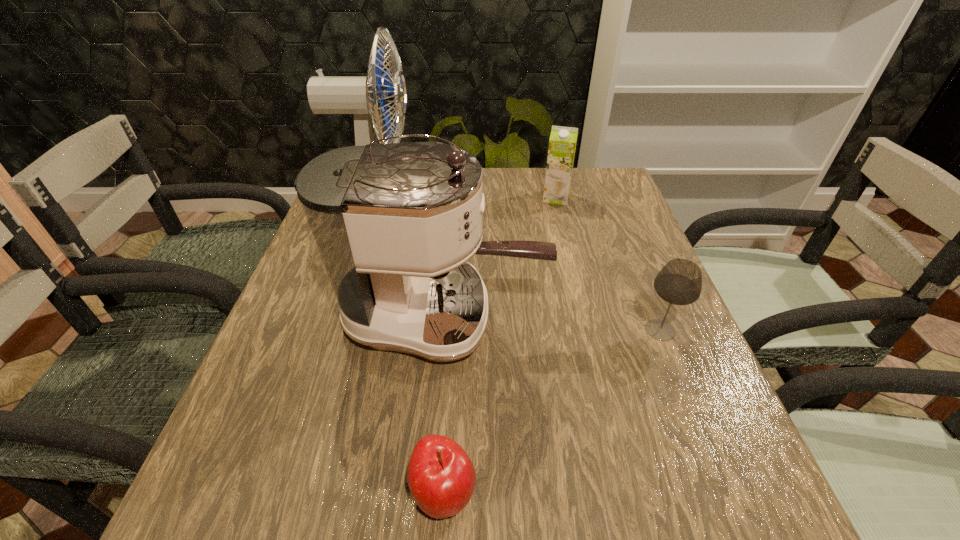
Where is `object at the far left corner`? object at the far left corner is located at coordinates [364, 96].

Locate an element on the screen. The image size is (960, 540). object located in the far right corner section of the desktop is located at coordinates (562, 144).

I want to click on vacant region at the far edge, so click(x=568, y=205).

The width and height of the screenshot is (960, 540). In the image, there is a desktop. What are the coordinates of `vacant space at the left edge` in the screenshot? It's located at [x=263, y=384].

Locate an element on the screen. This screenshot has width=960, height=540. vacant area at the right edge is located at coordinates (635, 252).

At what (x,y) coordinates should I click in order to perform the action: click on vacant space at the far right corner. Please return your answer as a coordinate pair (x, y). Looking at the image, I should click on (615, 174).

I want to click on free space between the coffee maker and the fourth object from left to right, so click(x=500, y=258).

This screenshot has width=960, height=540. I want to click on unoccupied position between the nearest object and the coffee maker, so click(444, 405).

Locate an element on the screen. free spot between the fourth tallest object and the coffee maker is located at coordinates (552, 323).

The height and width of the screenshot is (540, 960). Find the location of `vacant space that is in between the second object from right to left and the nearest object`. vacant space that is in between the second object from right to left and the nearest object is located at coordinates (500, 345).